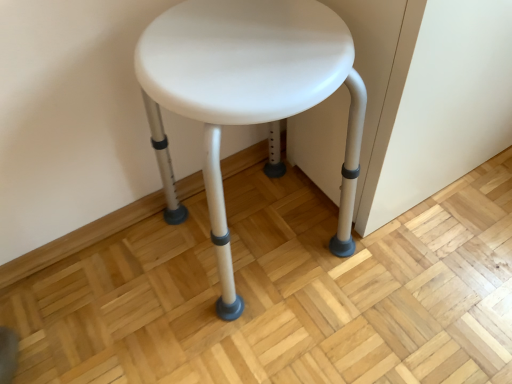
You are a GUI agent. You are given a task and a screenshot of the screen. Output one action in this format:
    pyautogui.click(x=<x>, y=<y>)
    Task: Click on the free space above white plastic stool at center (from a real-world perspective)
    This screenshot has width=512, height=384.
    Given the screenshot: What is the action you would take?
    pyautogui.click(x=237, y=49)